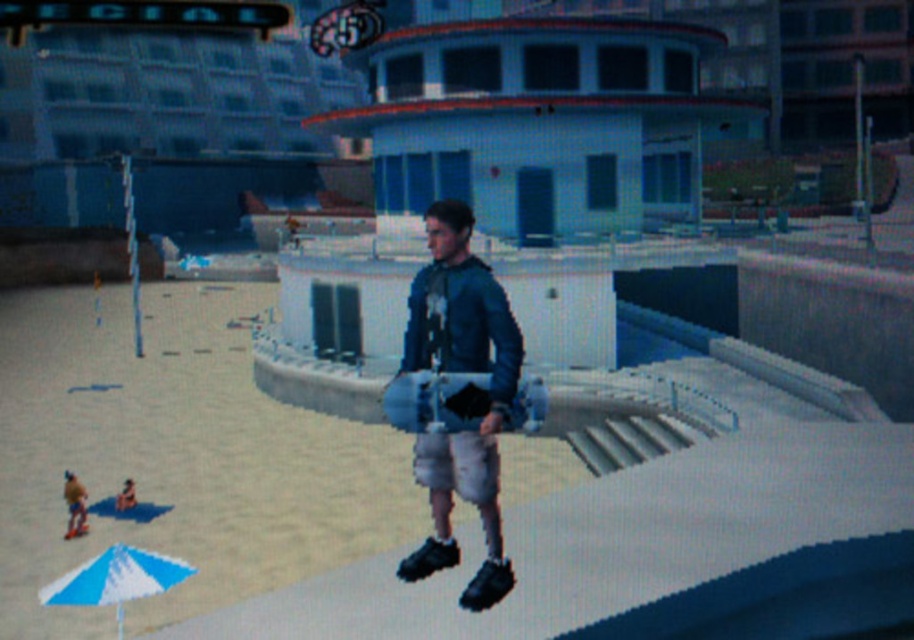
Between matte blue skateboard at center and white cotton shorts at center, which one appears on the right side from the viewer's perspective?

white cotton shorts at center

Which of these two, matte blue skateboard at center or white cotton shorts at center, stands taller?

With more height is matte blue skateboard at center.

Find the location of a particular element. The image size is (914, 640). matte blue skateboard at center is located at coordinates (461, 371).

Describe the element at coordinates (458, 465) in the screenshot. I see `white cotton shorts at center` at that location.

This screenshot has width=914, height=640. I want to click on white cotton shorts at center, so click(458, 465).

Does matte gray skateboard at center have a smaller size compared to white cotton shorts at center?

Actually, matte gray skateboard at center might be larger than white cotton shorts at center.

Is matte gray skateboard at center thinner than white cotton shorts at center?

Incorrect, matte gray skateboard at center's width is not less than white cotton shorts at center's.

Between point (434, 394) and point (491, 492), which one is positioned in front?

Point (434, 394) is more forward.

This screenshot has height=640, width=914. I want to click on matte gray skateboard at center, so click(436, 401).